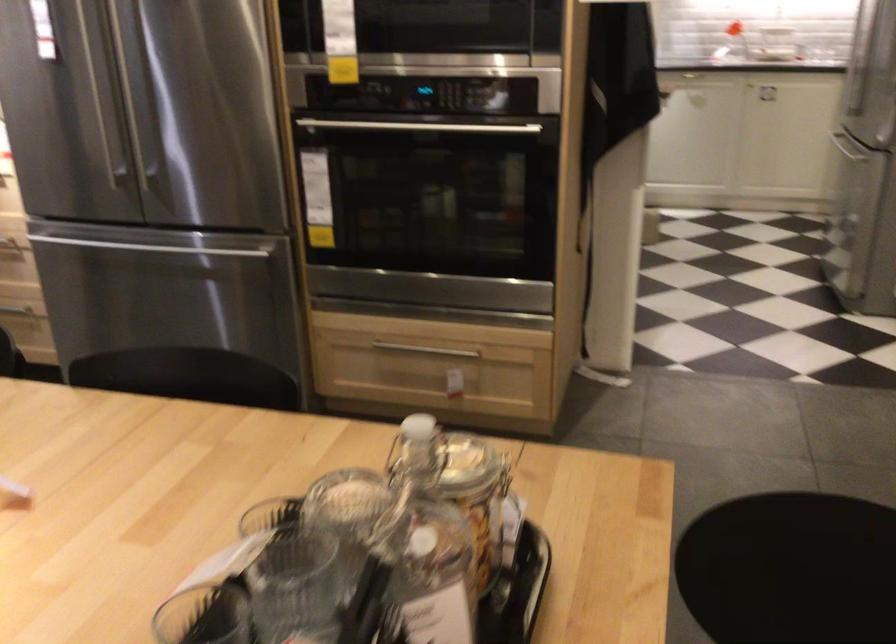
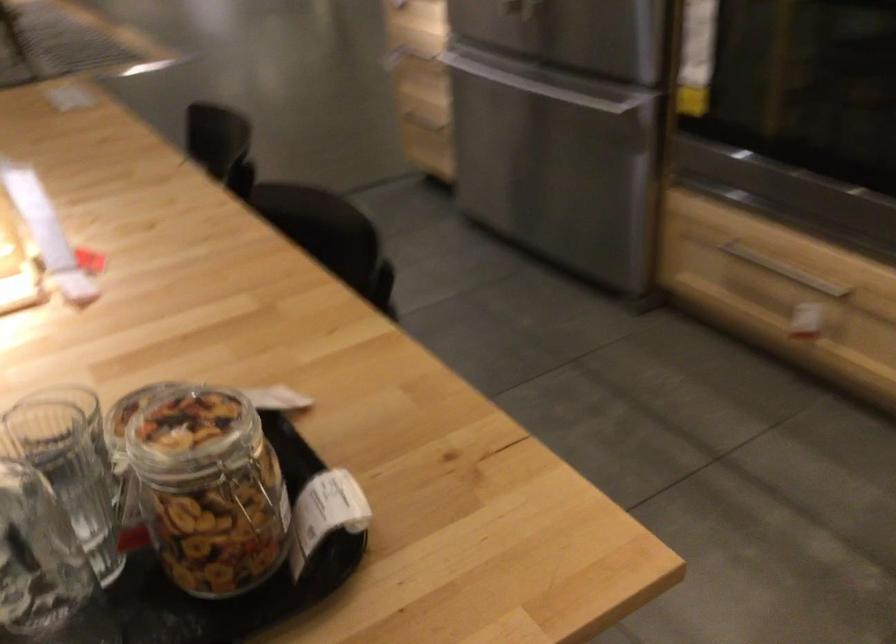
Locate, in the second image, the point that corresponds to pixel 142 231 in the first image.

(523, 68)